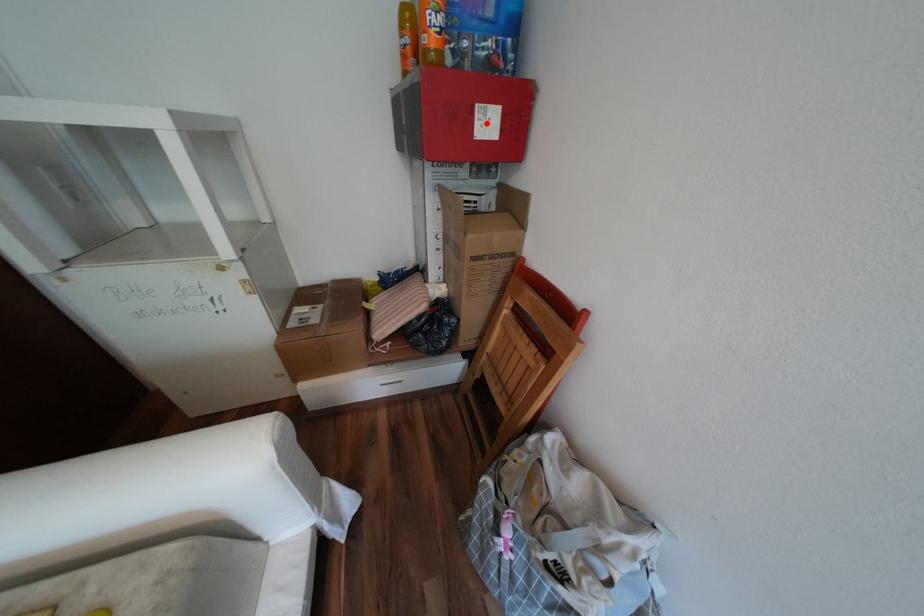
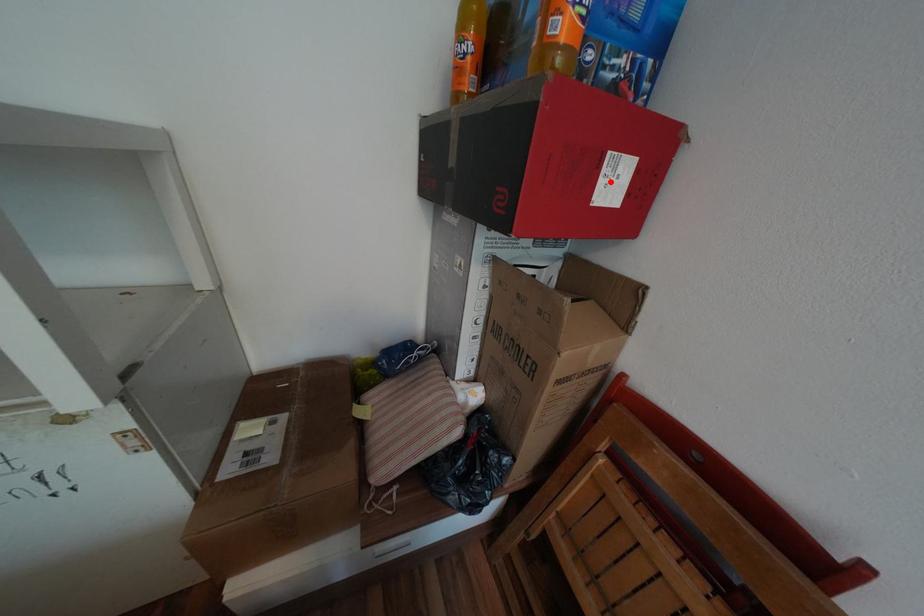
From the picture: I am providing you with two images of the same scene from different viewpoints. A red point is marked on the first image and another point is marked on the second image. Are the points marked in image1 and image2 representing the same 3D position?

Yes